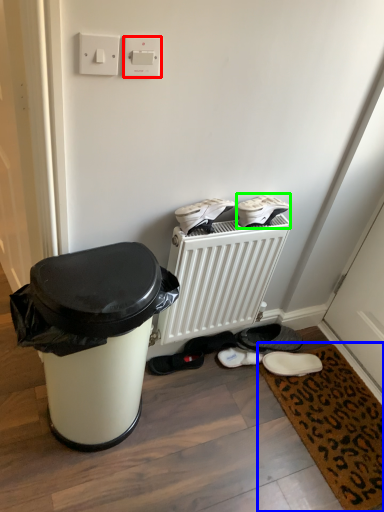
Question: Estimate the real-world distances between objects in this image. Which object is farther from electric outlet (highlighted by a red box), doormat (highlighted by a blue box) or footwear (highlighted by a green box)?

Choices:
 (A) doormat
 (B) footwear

Answer: (A)